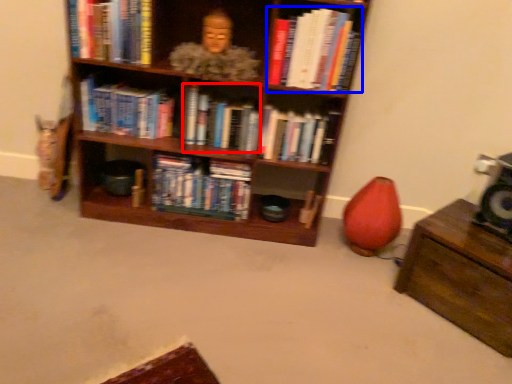
Question: Among these objects, which one is nearest to the camera, book (highlighted by a red box) or book (highlighted by a blue box)?

Choices:
 (A) book
 (B) book

Answer: (B)